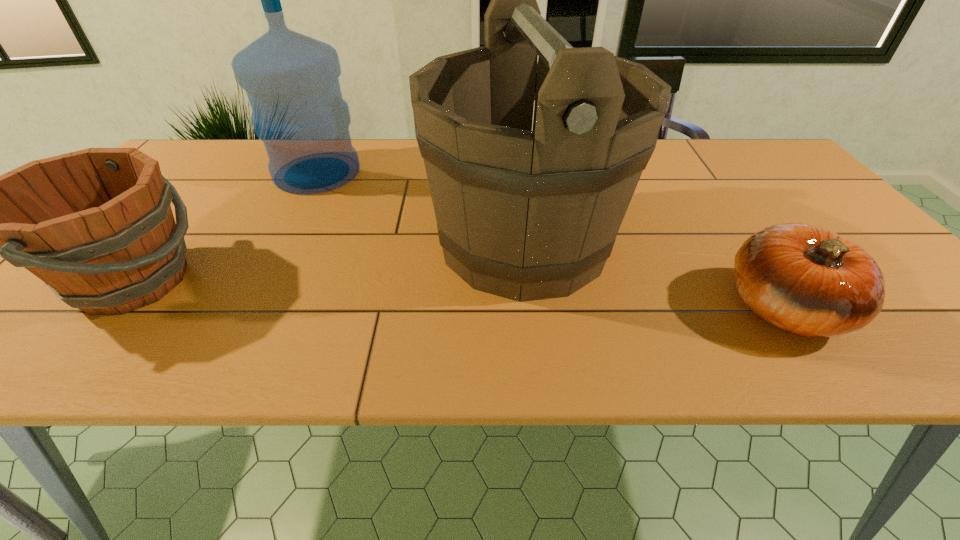
Find the location of a particular element. This screenshot has height=540, width=960. vacant space situated on the left of the shortest object is located at coordinates (639, 308).

Identify the location of object present at the far edge. This screenshot has width=960, height=540. (291, 80).

The image size is (960, 540). I want to click on bucket present at the near edge, so click(96, 226).

Where is `pumpkin that is at the near edge`? pumpkin that is at the near edge is located at coordinates (807, 280).

Image resolution: width=960 pixels, height=540 pixels. I want to click on object that is at the left edge, so click(96, 226).

Identify the location of object located in the near left corner section of the desktop. This screenshot has width=960, height=540. (96, 226).

Identify the location of free space at the far edge of the desktop. (725, 178).

Identify the location of vacant area at the near edge. (398, 354).

Find the location of a particular element. vacant area at the left edge of the desktop is located at coordinates point(43,325).

Identify the location of vacant area at the right edge. The height and width of the screenshot is (540, 960). (804, 207).